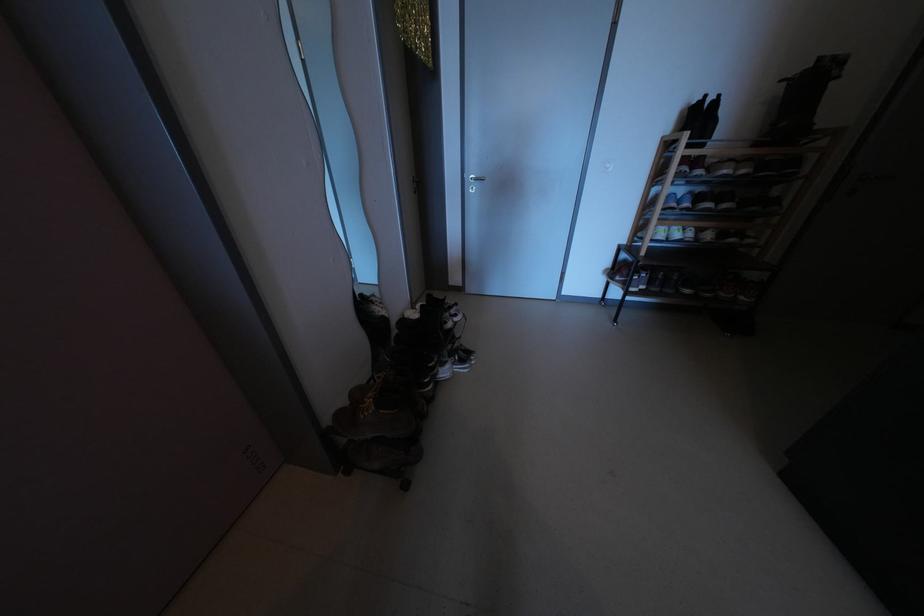
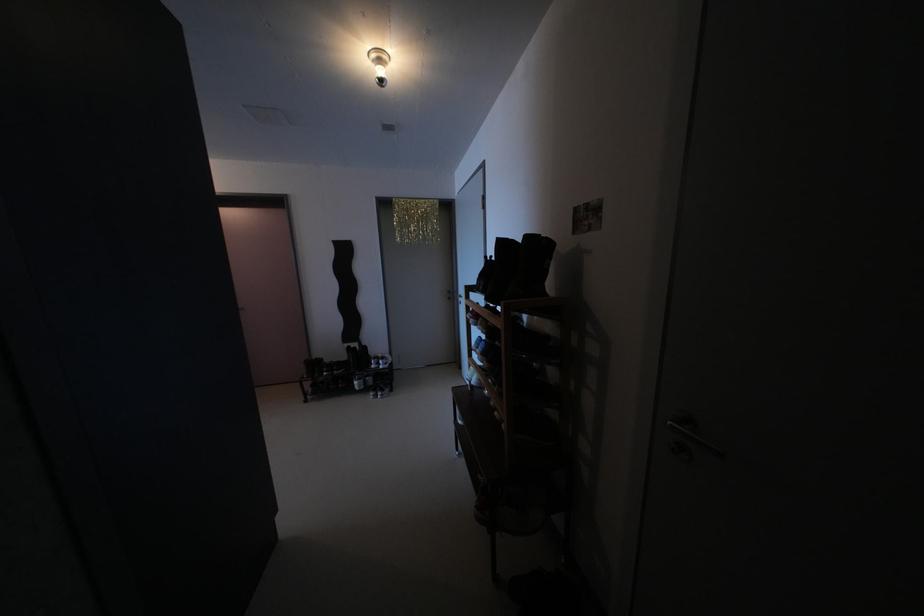
Find the pixel in the second image that matches [733,102] in the first image.

(504, 262)